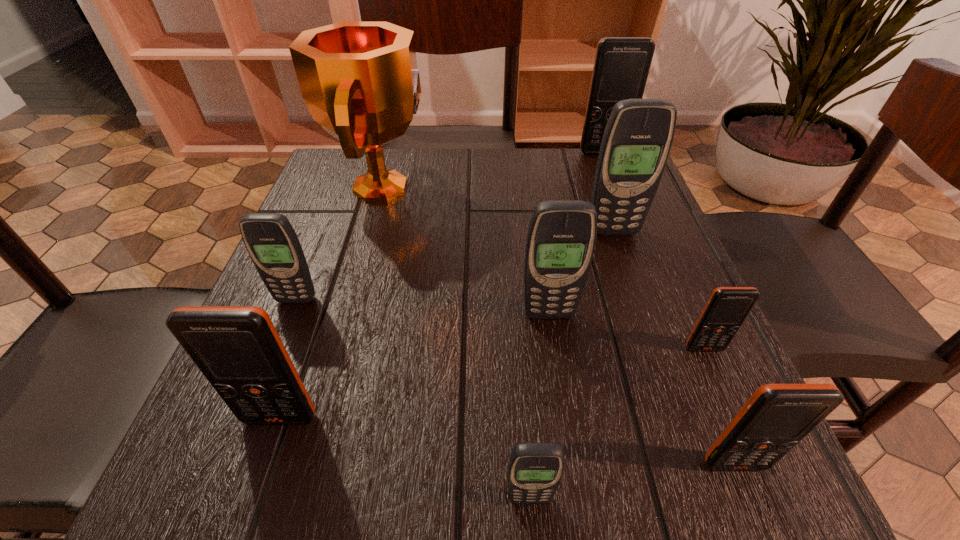
The image size is (960, 540). In order to click on the third nearest gray cellular telephone in this screenshot , I will do `click(272, 243)`.

Find the location of `the second nearest object`. the second nearest object is located at coordinates (777, 417).

The height and width of the screenshot is (540, 960). What are the coordinates of `the second nearest cellular telephone` in the screenshot? It's located at (777, 417).

This screenshot has height=540, width=960. In order to click on the fourth nearest cellular telephone in this screenshot , I will do `click(727, 308)`.

Where is `the second farthest orange cellular telephone`? the second farthest orange cellular telephone is located at coordinates [x=727, y=308].

Where is `the nearest object`? The image size is (960, 540). the nearest object is located at coordinates coord(535,470).

Image resolution: width=960 pixels, height=540 pixels. I want to click on the nearest gray cellular telephone, so click(x=535, y=470).

Locate an element on the screen. The height and width of the screenshot is (540, 960). vacant region located 0.050m on the side of the award with the star emblem is located at coordinates (452, 187).

Locate an element on the screen. This screenshot has width=960, height=540. vacant space located 0.200m on the screen of the farthest cellular telephone is located at coordinates (623, 203).

Find the location of a particular element. The height and width of the screenshot is (540, 960). vacant area situated 0.090m on the screen of the rightmost gray cellular telephone is located at coordinates (625, 267).